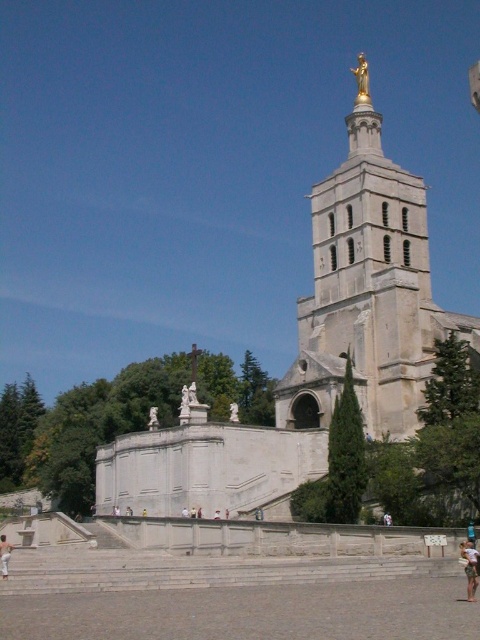
You are an architect designing a new plaza in front of the cathedral. You need to place a bench between the light brown wooden surfboard at lower right and the gold metallic statue at upper center. Which object should the bench be closer to if it has to be placed closer to the narrower object?

The bench should be placed closer to the light brown wooden surfboard at lower right because its width is less than the gold metallic statue at upper center.

You are standing at the base of the cathedral tower and see the light brown wooden surfboard at lower right. The surfboard is positioned on the plaza. If you want to reach the surfboard quickly, should you walk towards the tower entrance or directly towards the surfboard?

The light brown wooden surfboard at lower right is 37.52 meters away from camera, so you should walk directly towards the surfboard instead of going towards the tower entrance first.